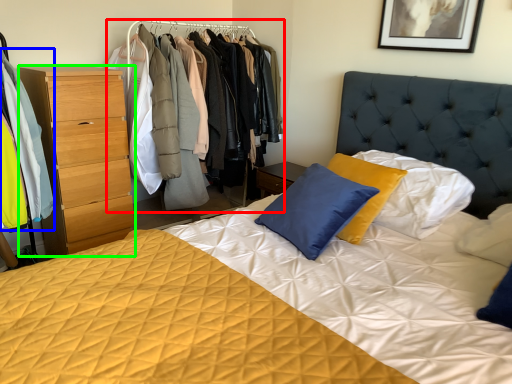
Question: Which is nearer to the dresser (highlighted by a red box)? clothing (highlighted by a blue box) or chest of drawers (highlighted by a green box).

Choices:
 (A) clothing
 (B) chest of drawers

Answer: (B)